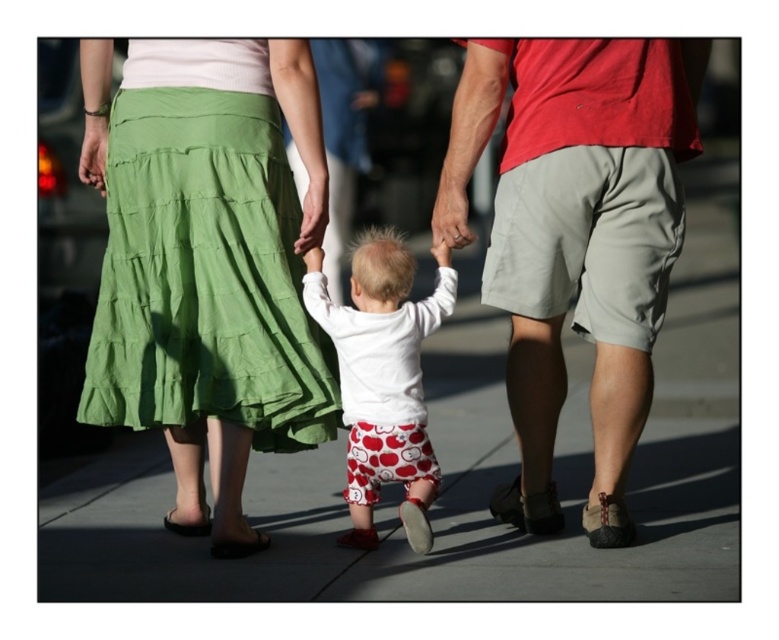
Question: Estimate the real-world distances between objects in this image. Which object is farther from the gray concrete pavement at center?

Choices:
 (A) black leather sandal at lower center
 (B) green cotton skirt at upper left
 (C) white matte pants at center
 (D) black leather sandal at lower left

Answer: (D)

Question: Is white matte pants at center below black leather sandal at lower center?

Choices:
 (A) yes
 (B) no

Answer: (B)

Question: Which of these objects is positioned farthest from the white matte pants at center?

Choices:
 (A) gray concrete pavement at center
 (B) green cotton skirt at upper left
 (C) black leather sandal at lower center
 (D) black leather sandal at lower left

Answer: (A)

Question: Can you confirm if green cotton skirt at upper left is thinner than white matte pants at center?

Choices:
 (A) yes
 (B) no

Answer: (B)

Question: Can you confirm if gray concrete pavement at center is wider than black leather sandal at lower center?

Choices:
 (A) yes
 (B) no

Answer: (A)

Question: Which is farther from the black leather sandal at lower center?

Choices:
 (A) black leather sandal at lower left
 (B) gray concrete pavement at center

Answer: (B)